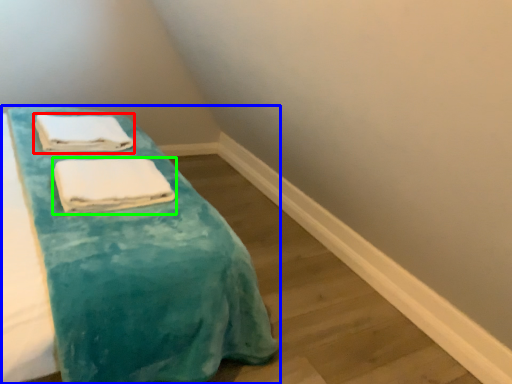
Question: Which object is positioned farthest from towel (highlighted by a red box)? Select from furniture (highlighted by a blue box) and towel (highlighted by a green box).

Choices:
 (A) furniture
 (B) towel

Answer: (A)